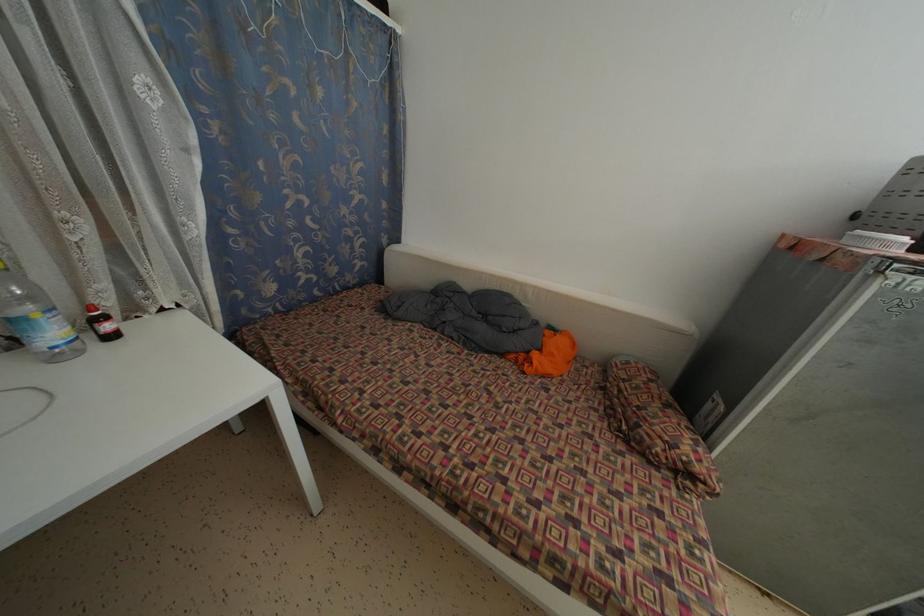
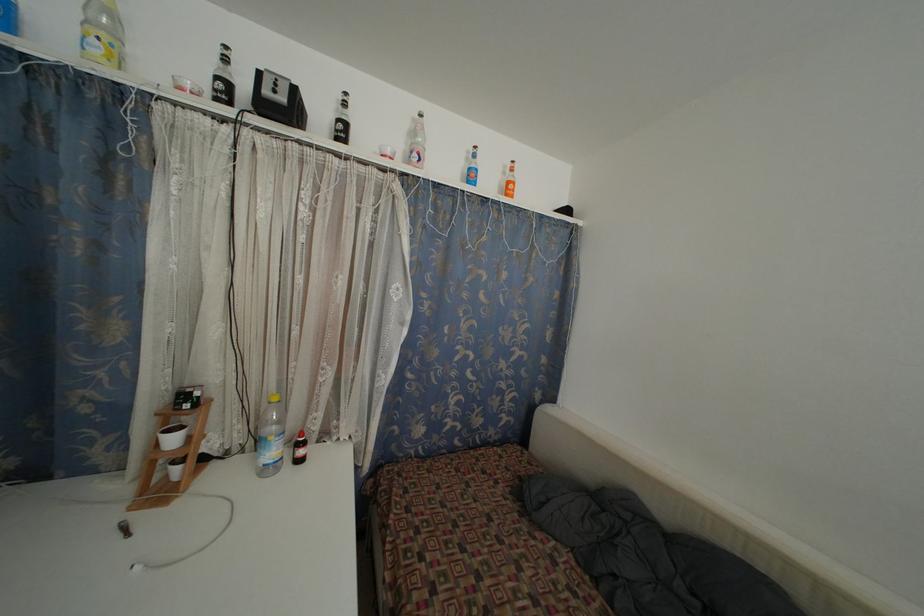
Find the pixel in the second image that matches (x=112, y=333) in the first image.

(305, 458)